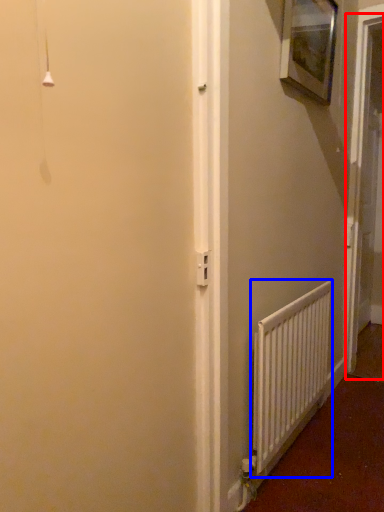
Question: Which object appears farthest to the camera in this image, screen door (highlighted by a red box) or radiator (highlighted by a blue box)?

Choices:
 (A) screen door
 (B) radiator

Answer: (A)